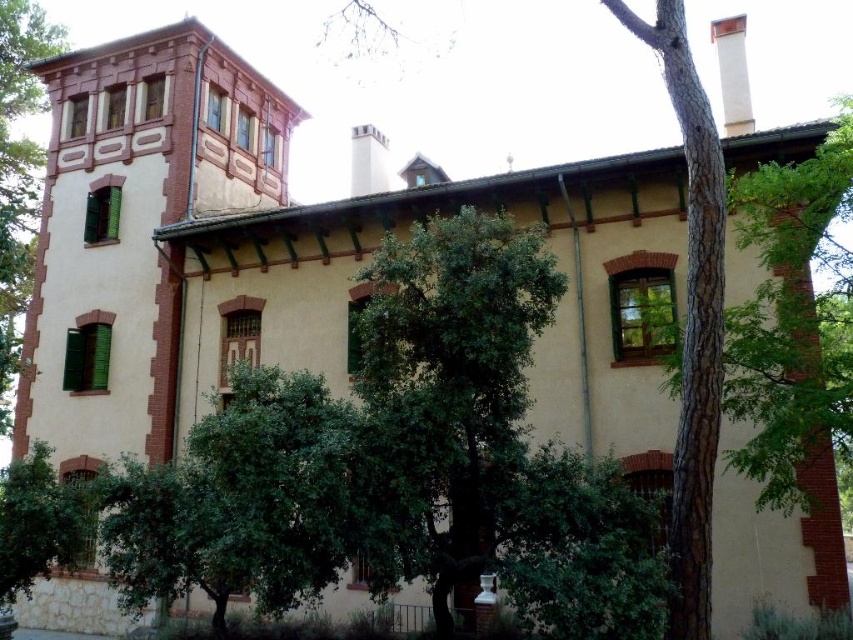
Does green leafy tree at center have a greater height compared to green leafy tree at left?

No, green leafy tree at center is not taller than green leafy tree at left.

Does green leafy tree at center have a greater width compared to green leafy tree at left?

No, green leafy tree at center is not wider than green leafy tree at left.

At what (x,y) coordinates should I click in order to perform the action: click on green leafy tree at center. Please return your answer as a coordinate pair (x, y). Looking at the image, I should click on (453, 378).

You are a GUI agent. You are given a task and a screenshot of the screen. Output one action in this format:
    pyautogui.click(x=<x>, y=<y>)
    Task: Click on the green leafy tree at center
    
    Given the screenshot: What is the action you would take?
    pyautogui.click(x=453, y=378)

Does green leafy tree at center appear over green textured bark at center?

Yes, green leafy tree at center is above green textured bark at center.

Does green leafy tree at center have a lesser width compared to green textured bark at center?

No, green leafy tree at center is not thinner than green textured bark at center.

At what (x,y) coordinates should I click in order to perform the action: click on green leafy tree at center. Please return your answer as a coordinate pair (x, y). Looking at the image, I should click on (453, 378).

Can you confirm if green textured bark at center is bigger than green leafy tree at left?

Incorrect, green textured bark at center is not larger than green leafy tree at left.

Identify the location of green textured bark at center. (692, 321).

Describe the element at coordinates (692, 321) in the screenshot. I see `green textured bark at center` at that location.

The width and height of the screenshot is (853, 640). I want to click on green textured bark at center, so click(x=692, y=321).